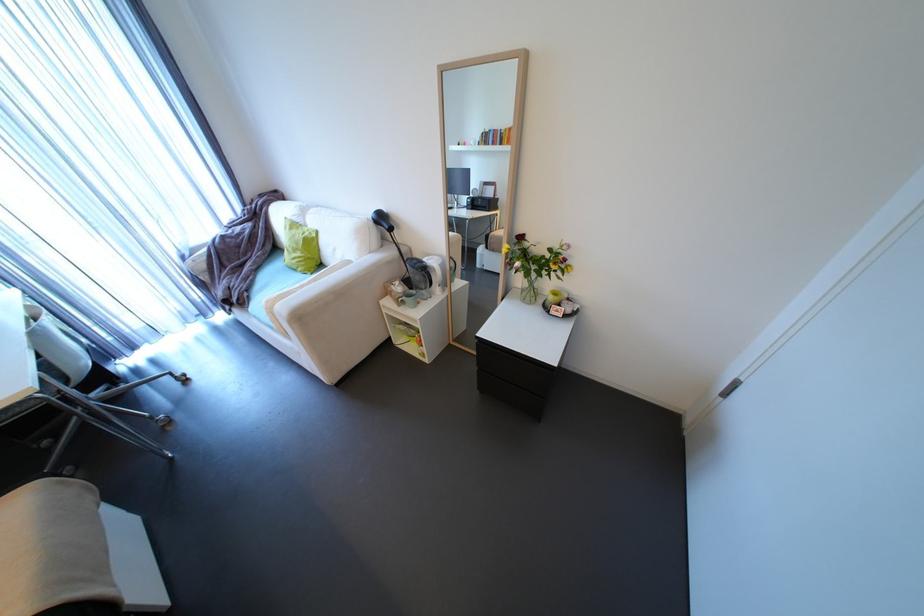
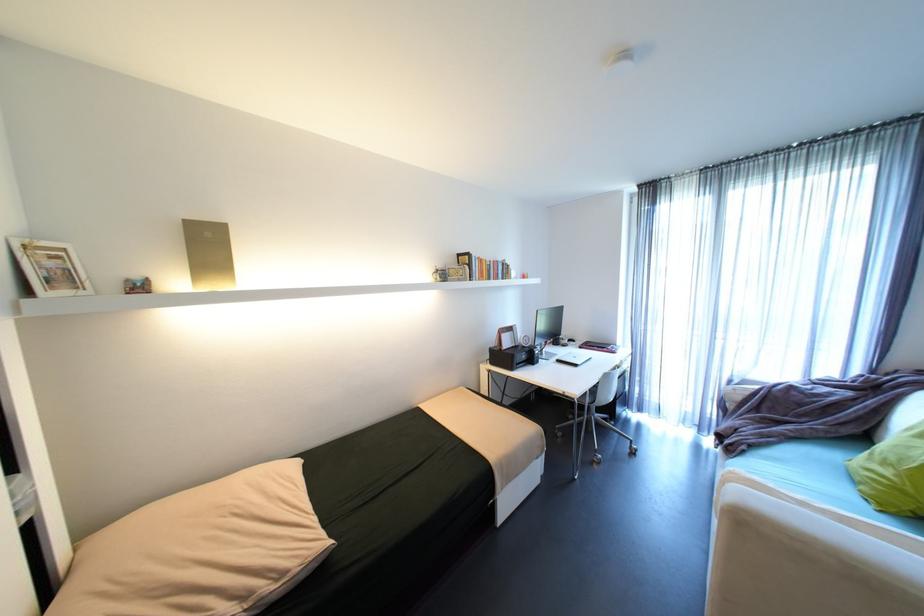
Find the pixel in the second image that matches pixel 310 253 in the first image.

(906, 476)